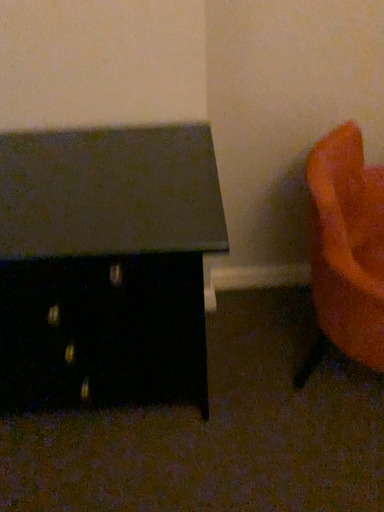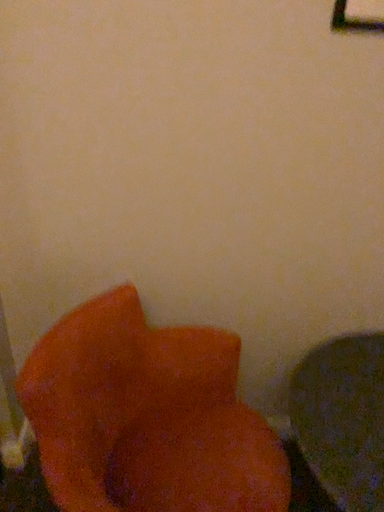
Question: How did the camera likely rotate when shooting the video?

Choices:
 (A) rotated downward
 (B) rotated upward

Answer: (B)